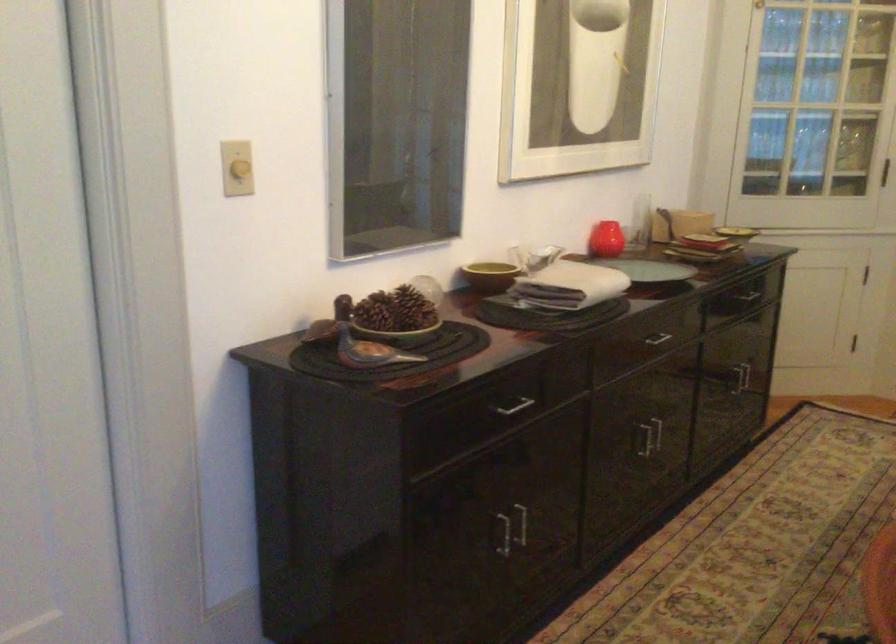
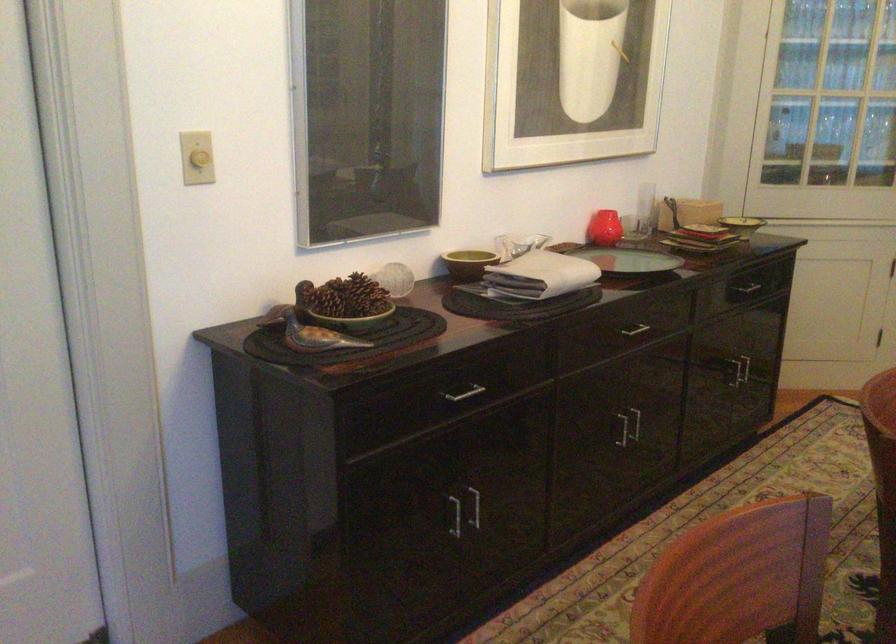
Where in the second image is the point corresponding to [707,240] from the first image?

(704, 230)